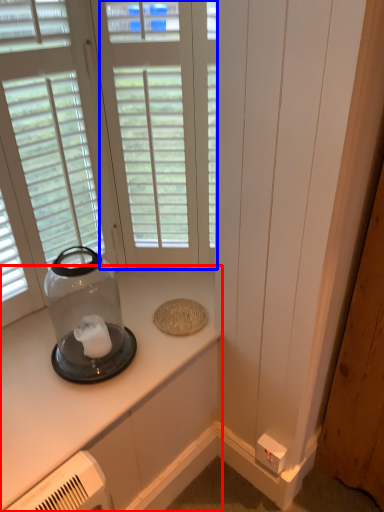
Question: Which point is closer to the camera, countertop (highlighted by a red box) or window (highlighted by a blue box)?

Choices:
 (A) countertop
 (B) window

Answer: (A)